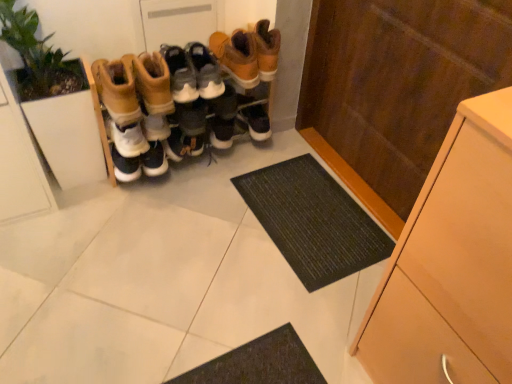
Question: Looking at their shapes, would you say brown suede boots at center, which appears as the 3th footwear when viewed from the left, is wider or thinner than black rubber doormat at center?

Choices:
 (A) wide
 (B) thin

Answer: (B)

Question: In the image, is brown suede boots at center, which appears as the 3th footwear when viewed from the left, positioned in front of or behind black rubber doormat at center?

Choices:
 (A) front
 (B) behind

Answer: (B)

Question: Based on their relative distances, which object is nearer to the leather boots at center, the second footwear in the right-to-left sequence?

Choices:
 (A) black rubber doormat at center
 (B) green leafy plant at left
 (C) matte wood cupboard at right
 (D) brown suede boots at center, which appears as the 3th footwear when viewed from the left
 (E) leather boots at center, the 1th footwear in the left-to-right sequence

Answer: (D)

Question: Considering the real-world distances, which object is farthest from the leather boots at center, the 1th footwear in the left-to-right sequence?

Choices:
 (A) leather boots at center, the second footwear in the right-to-left sequence
 (B) matte wood cupboard at right
 (C) brown suede boots at center, which appears as the 3th footwear when viewed from the left
 (D) light wood cabinet at right
 (E) green leafy plant at left

Answer: (D)